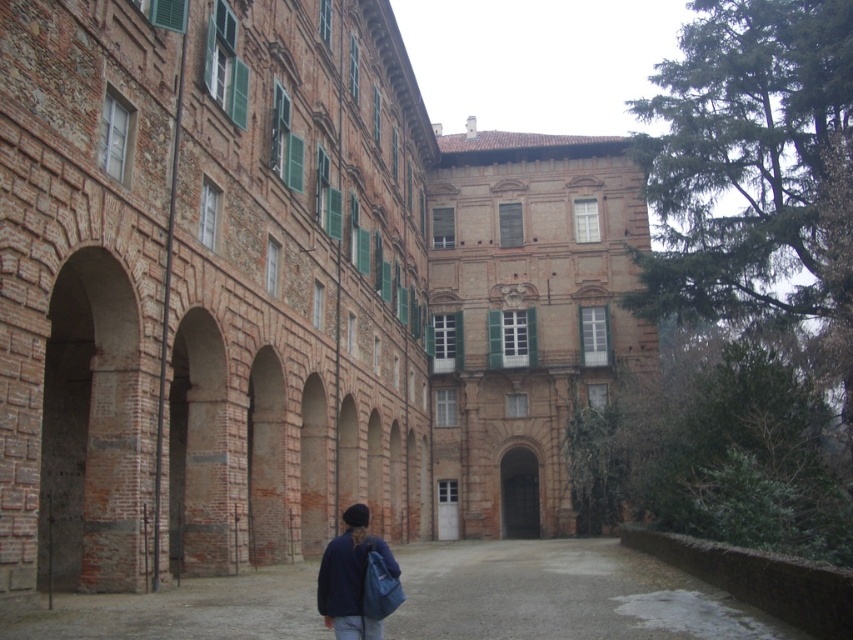
You are standing in front of the historical building and see the smooth brick courtyard at center and the dark blue fabric jacket at lower center. Which object is closer to you?

The dark blue fabric jacket at lower center is behind the smooth brick courtyard at center, so the smooth brick courtyard at center is closer to you.

You are standing in front of the historical building and want to take a photo. You notice two points marked on the building. The first point is at coordinates point (279,612) and the second is at point (392,573). Which point is closer to your camera when taking the photo?

Point (392,573) is closer to the camera because it is less further than point (279,612).

You are an architect visiting the historical building and want to place a large sculpture in the courtyard. Given that the sculpture requires a space twice the size of the dark blue fabric jacket at lower center, will the smooth brick courtyard at center be sufficient?

The smooth brick courtyard at center has a larger size compared to the dark blue fabric jacket at lower center. Since the sculpture requires twice the size of the jacket, and the courtyard is already larger than the jacket, it should be sufficient to accommodate the sculpture.